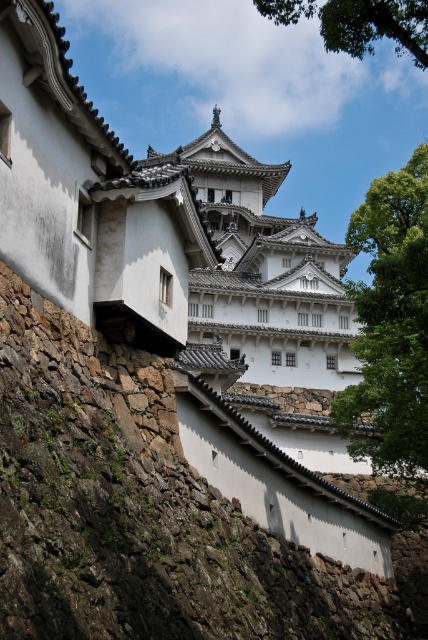
Question: Is white stone tower at center bigger than green leafy tree at upper center?

Choices:
 (A) yes
 (B) no

Answer: (B)

Question: Can you confirm if white stone tower at center is thinner than green leafy tree at upper center?

Choices:
 (A) yes
 (B) no

Answer: (A)

Question: Can you confirm if white stone tower at center is wider than green leafy tree at upper center?

Choices:
 (A) yes
 (B) no

Answer: (B)

Question: Which point is farther to the camera?

Choices:
 (A) green leafy tree at right
 (B) white stone tower at center

Answer: (B)

Question: Considering the real-world distances, which object is farthest from the green leafy tree at upper center?

Choices:
 (A) green leafy tree at right
 (B) white stone tower at center

Answer: (B)

Question: Which point is farther from the camera taking this photo?

Choices:
 (A) (379, 35)
 (B) (351, 392)

Answer: (B)